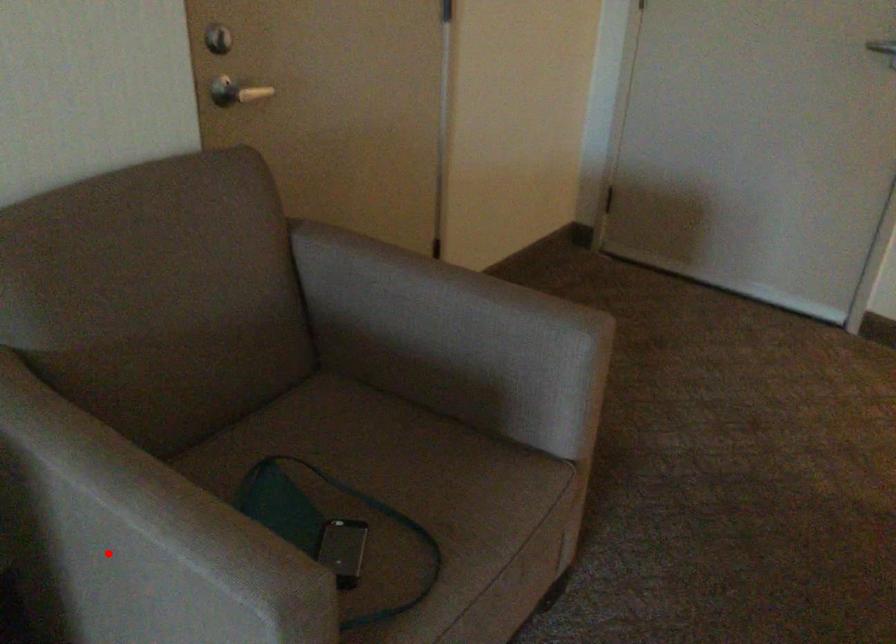
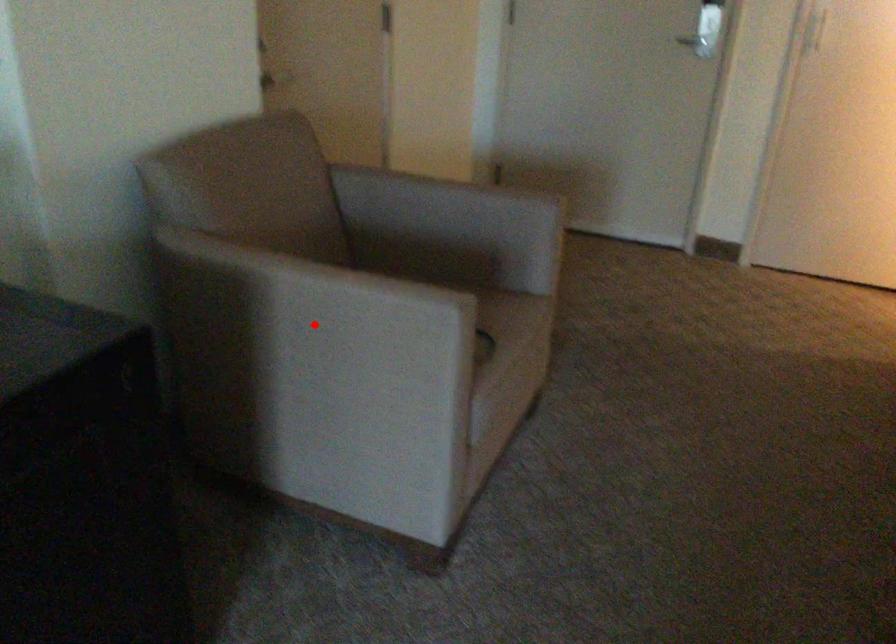
I am providing you with two images of the same scene from different viewpoints. A red point is marked on the first image and another point is marked on the second image. Is the marked point in image1 the same physical position as the marked point in image2?

Yes